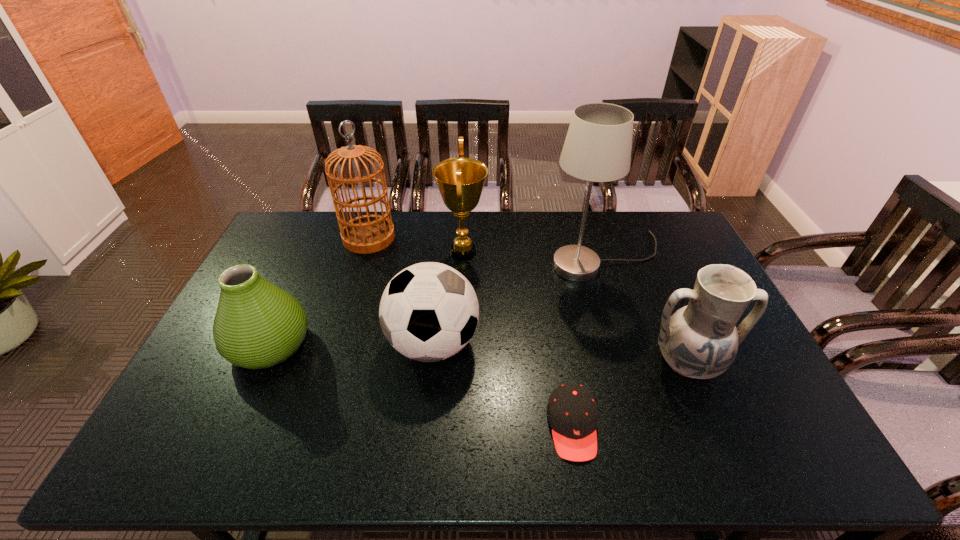
The width and height of the screenshot is (960, 540). Identify the location of free location located on the front view with handles of the third tallest object. (574, 252).

This screenshot has width=960, height=540. What are the coordinates of `vacant space positioned 0.060m on the front-facing side of the pitcher` in the screenshot? It's located at (708, 412).

Identify the location of blank space located on the right of the vase. (392, 345).

Identify the location of free spot located on the main logo of the soccer ball. (504, 343).

Locate an element on the screen. table lamp at the far edge is located at coordinates (597, 148).

Identify the location of birdcage that is at the far edge. (365, 234).

You are a GUI agent. You are given a task and a screenshot of the screen. Output one action in this format:
    pyautogui.click(x=<x>, y=<y>)
    Task: Click on the award at the far edge
    This screenshot has width=960, height=540.
    Given the screenshot: What is the action you would take?
    pyautogui.click(x=460, y=180)

Identify the location of object at the near edge. The width and height of the screenshot is (960, 540). (572, 412).

The image size is (960, 540). Identify the location of object situated at the left edge. (257, 325).

Locate an element on the screen. table lamp located at the right edge is located at coordinates (597, 148).